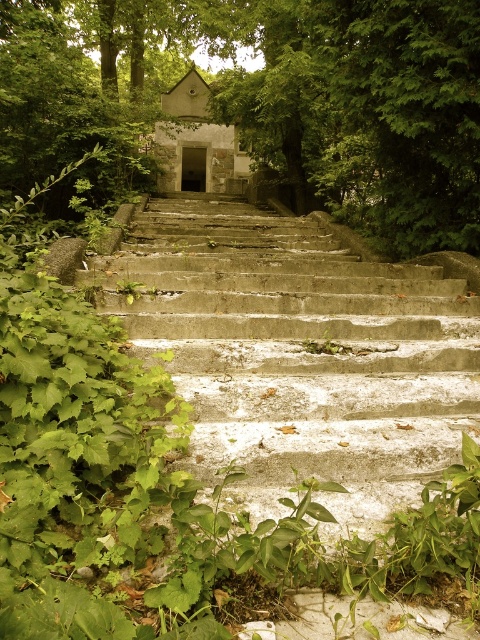
Which of these two, green leafy tree at center or concrete stairs at center, stands taller?

green leafy tree at center

Between green leafy tree at center and concrete stairs at center, which one is positioned higher?

green leafy tree at center is higher up.

Between point (68, 113) and point (247, 253), which one is positioned behind?

Point (68, 113)

Where is `green leafy tree at center`? This screenshot has height=640, width=480. green leafy tree at center is located at coordinates (264, 100).